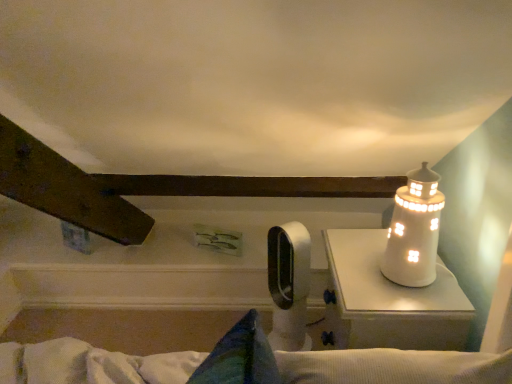
At what (x,y) coordinates should I click in order to perform the action: click on free point above white glossy lighthouse at right (from a real-world perspective). Please return your answer as a coordinate pair (x, y). Looking at the image, I should click on (391, 284).